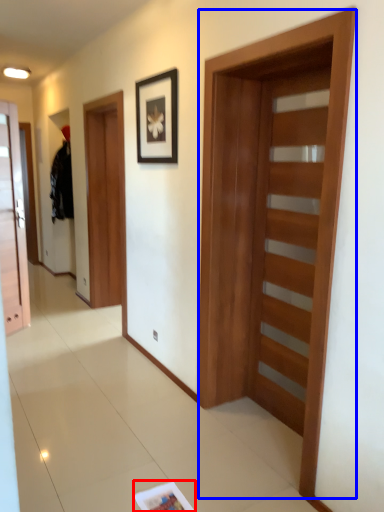
Question: Which point is closer to the camera, magazine (highlighted by a red box) or barn door (highlighted by a blue box)?

Choices:
 (A) magazine
 (B) barn door

Answer: (B)